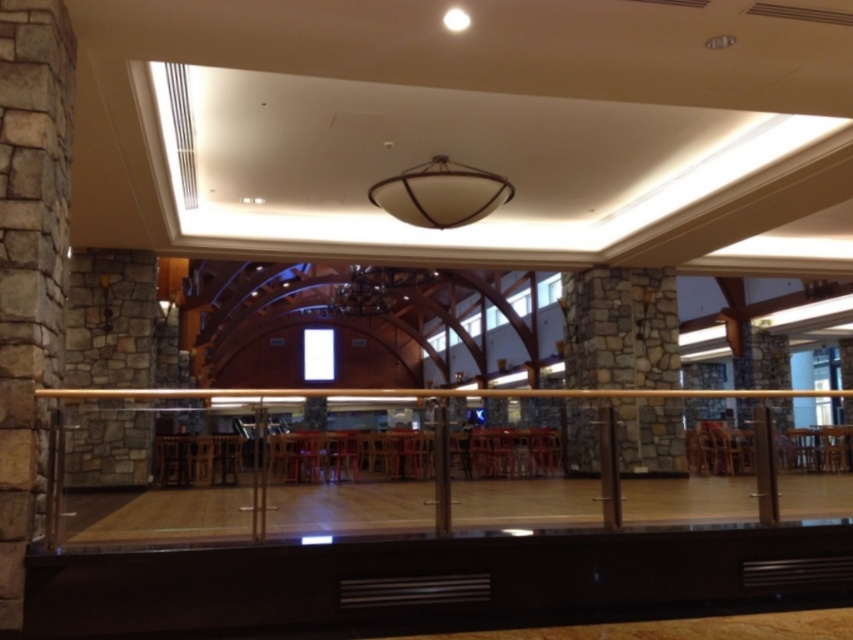
Is satin gold railing at center to the left of stone textured pillar at left from the viewer's perspective?

Incorrect, satin gold railing at center is not on the left side of stone textured pillar at left.

Between point (126, 506) and point (51, 332), which one is positioned behind?

Positioned behind is point (126, 506).

The height and width of the screenshot is (640, 853). Identify the location of satin gold railing at center. (402, 484).